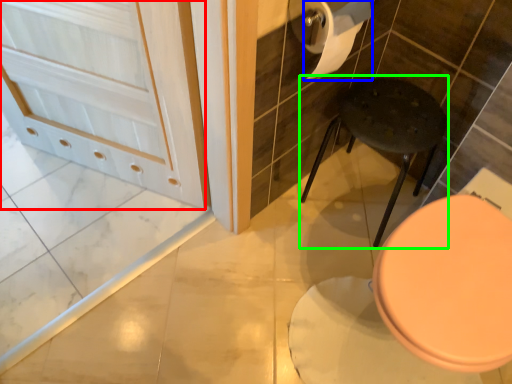
Question: Based on their relative distances, which object is farther from screen door (highlighted by a red box)? Choose from toilet paper (highlighted by a blue box) and bar stool (highlighted by a green box).

Choices:
 (A) toilet paper
 (B) bar stool

Answer: (B)